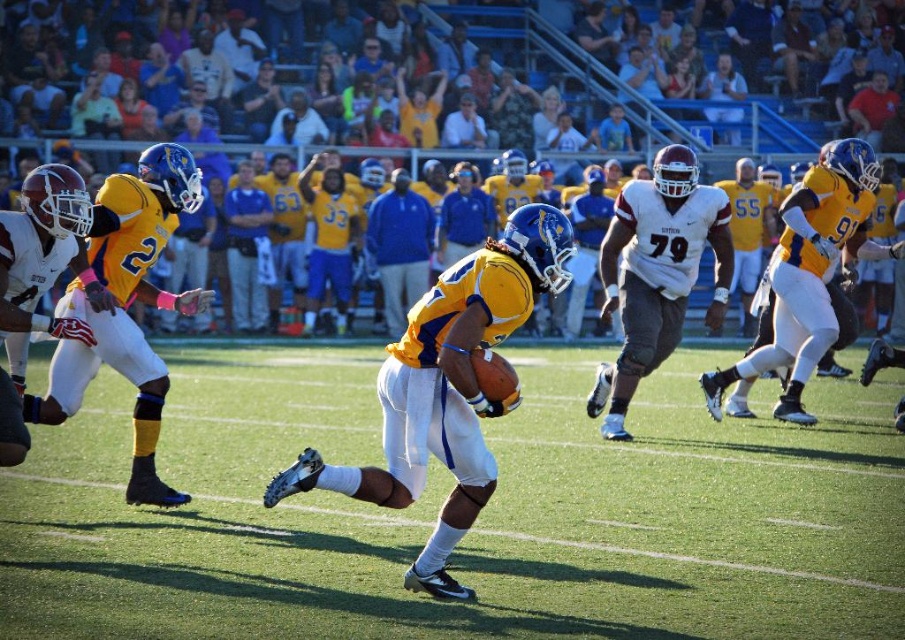
Can you confirm if white matte jersey at center is taller than blue jersey at center?

Yes, white matte jersey at center is taller than blue jersey at center.

I want to click on white matte jersey at center, so click(x=656, y=273).

Between point (675, 285) and point (234, 237), which one is positioned in front?

Point (675, 285) is in front.

Locate an element on the screen. The image size is (905, 640). white matte jersey at center is located at coordinates (656, 273).

Is point (661, 440) farther from viewer compared to point (435, 420)?

That is True.

Is green grass football field at center taller than yellow matte jersey at center?

In fact, green grass football field at center may be shorter than yellow matte jersey at center.

Is point (192, 502) positioned behind point (543, 221)?

Yes, it is.

You are a GUI agent. You are given a task and a screenshot of the screen. Output one action in this format:
    pyautogui.click(x=<x>, y=<y>)
    Task: Click on the green grass football field at center
    
    Given the screenshot: What is the action you would take?
    pyautogui.click(x=473, y=525)

Between yellow matte jersey at center and matte yellow jersey at left, which one appears on the left side from the viewer's perspective?

Positioned to the left is matte yellow jersey at left.

Is yellow matte jersey at center smaller than matte yellow jersey at left?

Yes, yellow matte jersey at center is smaller than matte yellow jersey at left.

Image resolution: width=905 pixels, height=640 pixels. I want to click on yellow matte jersey at center, so click(x=446, y=388).